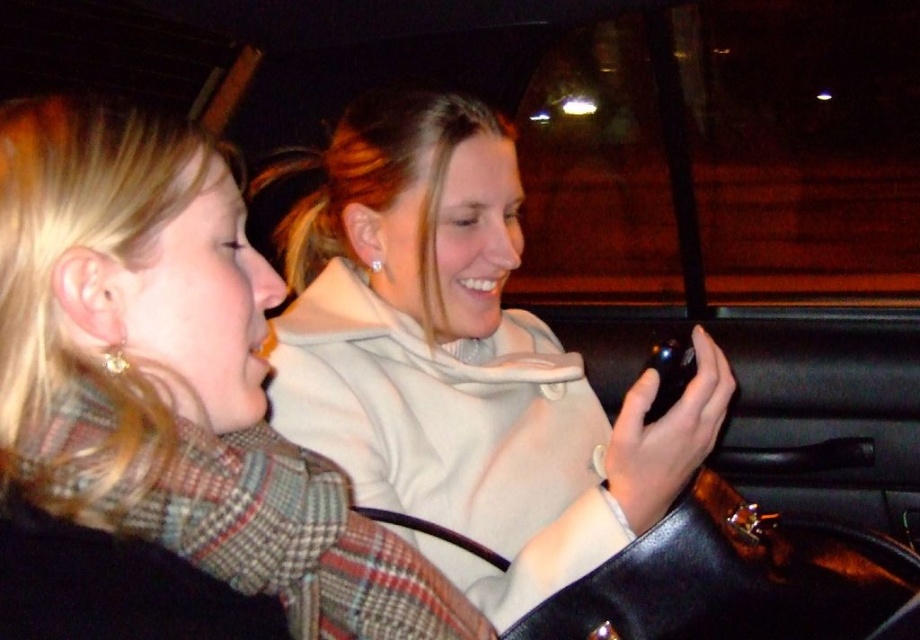
You are a photographer inside a moving car at night. You notice the plaid wool scarf at center and the white matte hoodie at center. Which object is closer to the right side of the car?

The plaid wool scarf at center is to the right of the white matte hoodie at center, so it is closer to the right side of the car.

You are a photographer trying to capture a clear photo of both the plaid wool scarf at center and the white matte hoodie at center in the dimly lit car. Which object should you focus on first to ensure both are in focus?

The plaid wool scarf at center is closer to the viewer than the white matte hoodie at center. To ensure both are in focus, focus on the plaid wool scarf at center first since it is closer, and the depth of field may extend to the hoodie.

You are designing a storage compartment for the car that needs to accommodate both the plaid wool scarf at center and the white matte hoodie at center. Given their widths, which item requires more horizontal space in the compartment?

The white matte hoodie at center requires more horizontal space in the compartment because it has a greater width than the plaid wool scarf at center.